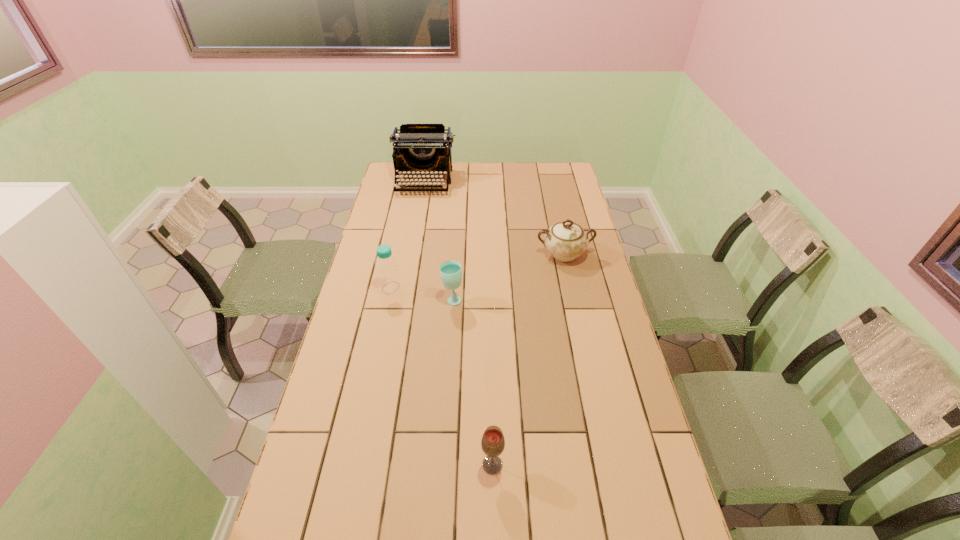
Where is `typewriter`? typewriter is located at coordinates (417, 148).

Identify the location of the farthest object. (417, 148).

Locate an element on the screen. Image resolution: width=960 pixels, height=540 pixels. bottle is located at coordinates (388, 275).

Where is `chinaware`? chinaware is located at coordinates (566, 240).

At what (x,y) coordinates should I click in order to perform the action: click on the second farthest object. Please return your answer as a coordinate pair (x, y). Looking at the image, I should click on (566, 240).

The image size is (960, 540). I want to click on the right glass, so click(493, 443).

I want to click on the nearer glass, so click(x=493, y=443).

This screenshot has width=960, height=540. What are the coordinates of `the left glass` in the screenshot? It's located at (451, 273).

Locate an element on the screen. The height and width of the screenshot is (540, 960). free space located on the typing side of the typewriter is located at coordinates (412, 250).

Image resolution: width=960 pixels, height=540 pixels. Find the location of `blank space located 0.060m on the back of the bottle`. blank space located 0.060m on the back of the bottle is located at coordinates (395, 268).